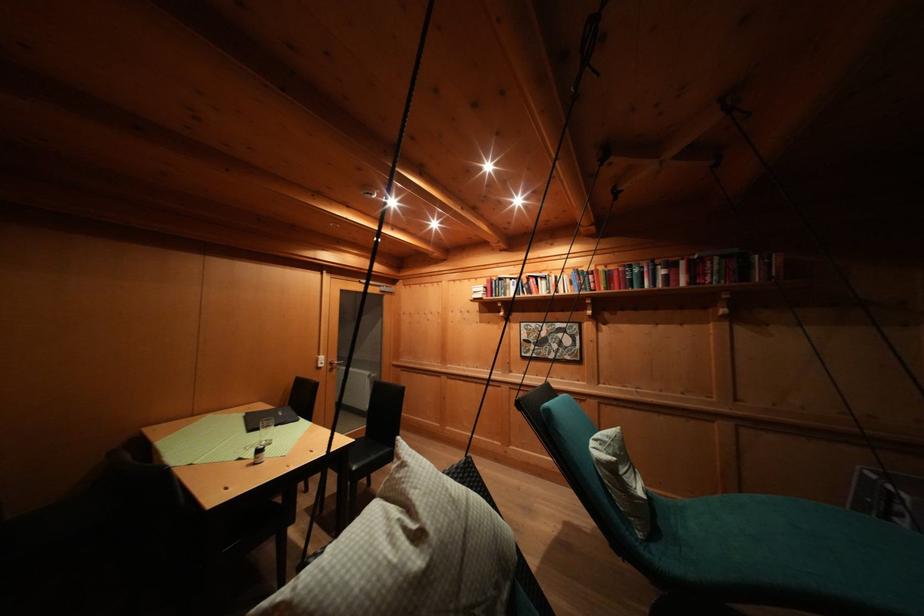
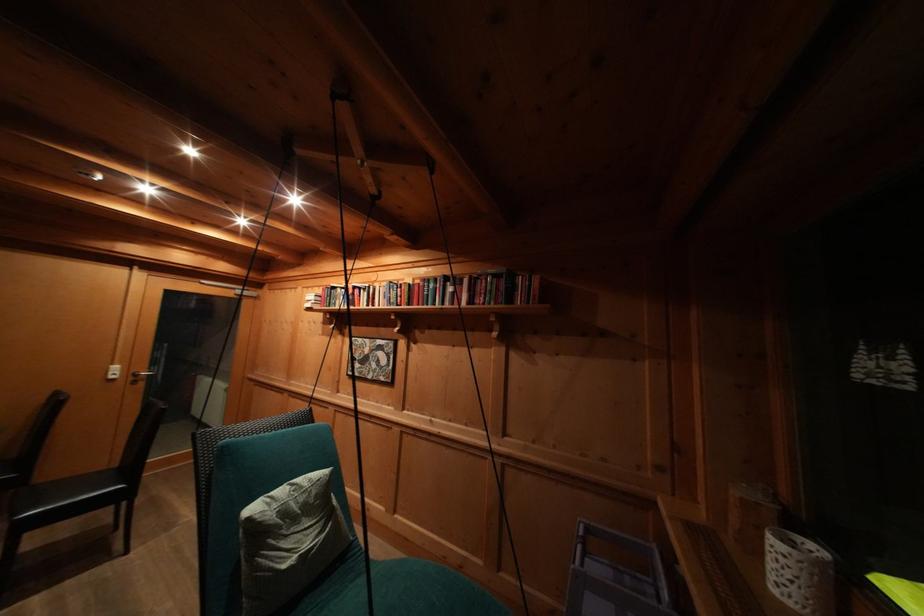
Where in the second image is the point corresponding to (337,369) from the first image?

(141, 379)